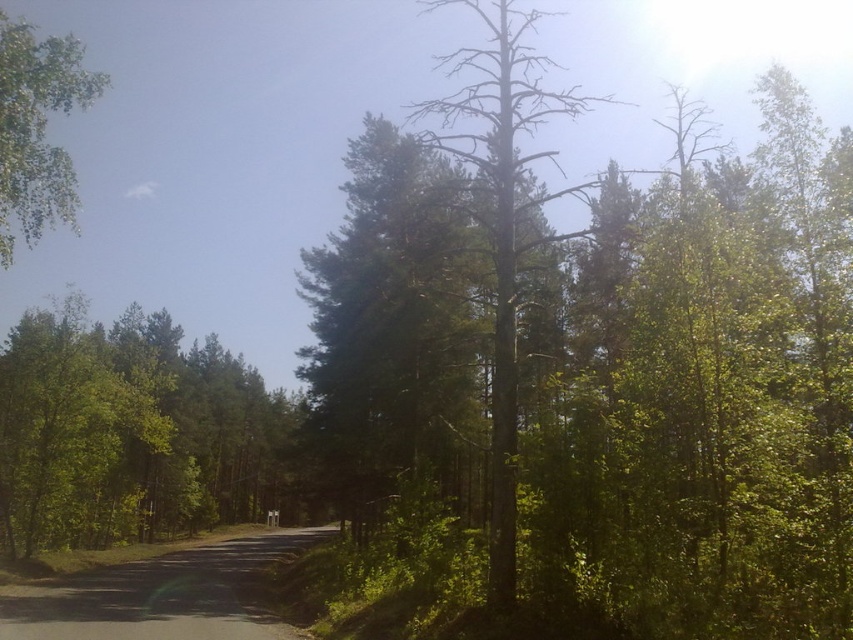
Is brown bark tree at center smaller than green leafy tree at upper left?

Yes.

Can you confirm if brown bark tree at center is positioned above green leafy tree at upper left?

Incorrect, brown bark tree at center is not positioned above green leafy tree at upper left.

This screenshot has width=853, height=640. I want to click on brown bark tree at center, so click(x=503, y=218).

Does green leafy tree at center have a smaller size compared to green leafy tree at upper left?

Yes.

Can you confirm if green leafy tree at center is shorter than green leafy tree at upper left?

Indeed, green leafy tree at center has a lesser height compared to green leafy tree at upper left.

Image resolution: width=853 pixels, height=640 pixels. I want to click on green leafy tree at center, so click(128, 432).

You are a GUI agent. You are given a task and a screenshot of the screen. Output one action in this format:
    pyautogui.click(x=<x>, y=<y>)
    Task: Click on the green leafy tree at center
    
    Given the screenshot: What is the action you would take?
    pyautogui.click(x=128, y=432)

Is green leafy tree at center smaller than brown bark tree at center?

Indeed, green leafy tree at center has a smaller size compared to brown bark tree at center.

Image resolution: width=853 pixels, height=640 pixels. Describe the element at coordinates (128, 432) in the screenshot. I see `green leafy tree at center` at that location.

The height and width of the screenshot is (640, 853). I want to click on green leafy tree at center, so click(x=128, y=432).